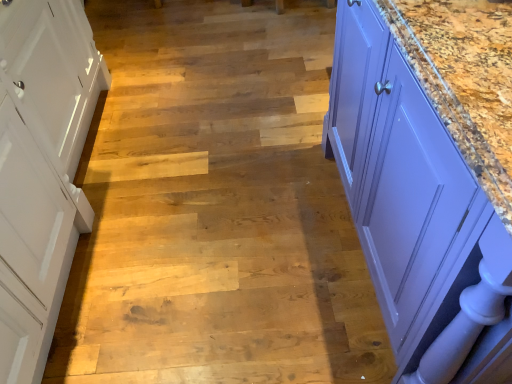
Question: Is wooden stair at center bigger than white wood cabinet at left?

Choices:
 (A) no
 (B) yes

Answer: (A)

Question: From the image's perspective, is wooden stair at center located above white wood cabinet at left?

Choices:
 (A) no
 (B) yes

Answer: (B)

Question: From a real-world perspective, is wooden stair at center located beneath white wood cabinet at left?

Choices:
 (A) yes
 (B) no

Answer: (A)

Question: From the image's perspective, is wooden stair at center located beneath white wood cabinet at left?

Choices:
 (A) yes
 (B) no

Answer: (B)

Question: From a real-world perspective, is wooden stair at center located higher than white wood cabinet at left?

Choices:
 (A) no
 (B) yes

Answer: (A)

Question: Is wooden stair at center far from white wood cabinet at left?

Choices:
 (A) no
 (B) yes

Answer: (A)

Question: Can you confirm if wooden stair at center is smaller than purple glossy cabinet at right?

Choices:
 (A) yes
 (B) no

Answer: (A)

Question: Is wooden stair at center bigger than purple glossy cabinet at right?

Choices:
 (A) no
 (B) yes

Answer: (A)

Question: From a real-world perspective, is wooden stair at center located beneath purple glossy cabinet at right?

Choices:
 (A) no
 (B) yes

Answer: (B)

Question: Considering the relative positions of wooden stair at center and purple glossy cabinet at right in the image provided, is wooden stair at center in front of purple glossy cabinet at right?

Choices:
 (A) yes
 (B) no

Answer: (B)

Question: Is purple glossy cabinet at right at the back of wooden stair at center?

Choices:
 (A) no
 (B) yes

Answer: (A)

Question: Can you confirm if wooden stair at center is positioned to the right of purple glossy cabinet at right?

Choices:
 (A) no
 (B) yes

Answer: (A)

Question: Is purple glossy cabinet at right to the right of wooden stair at center from the viewer's perspective?

Choices:
 (A) no
 (B) yes

Answer: (B)